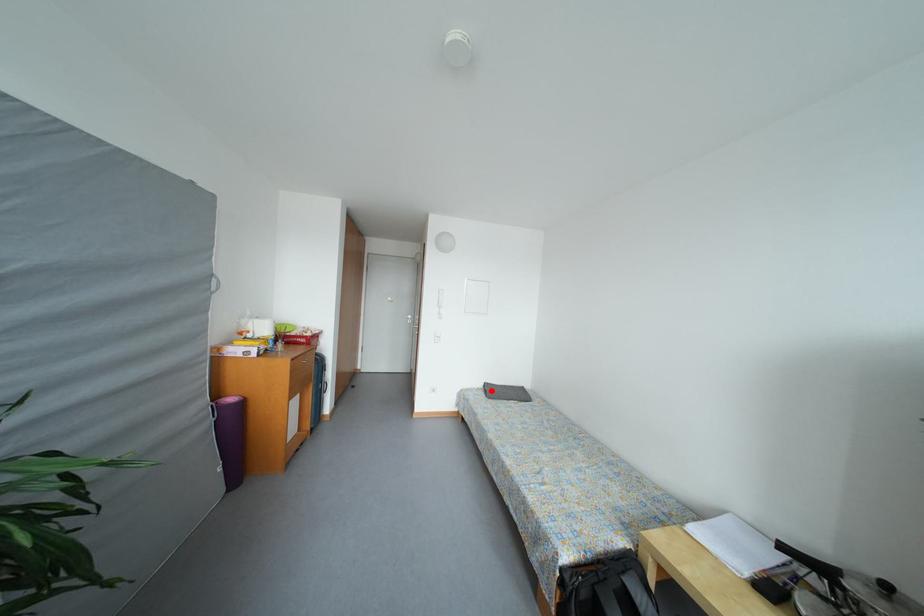
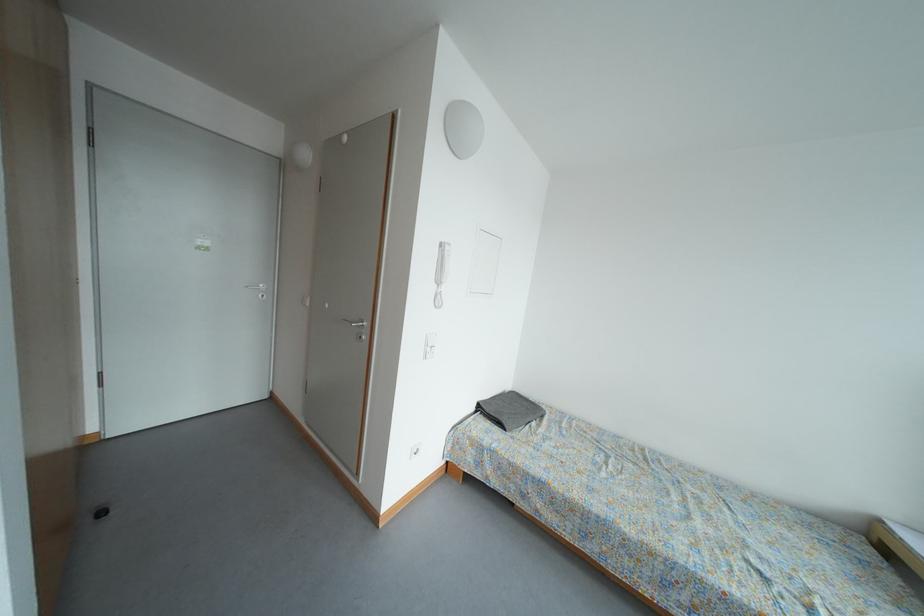
The point at the highlighted location is marked in the first image. Where is the corresponding point in the second image?

(485, 411)